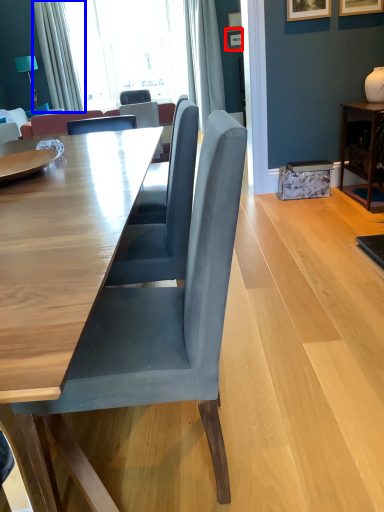
Question: Which object appears farthest to the camera in this image, picture frame (highlighted by a red box) or curtain (highlighted by a blue box)?

Choices:
 (A) picture frame
 (B) curtain

Answer: (A)